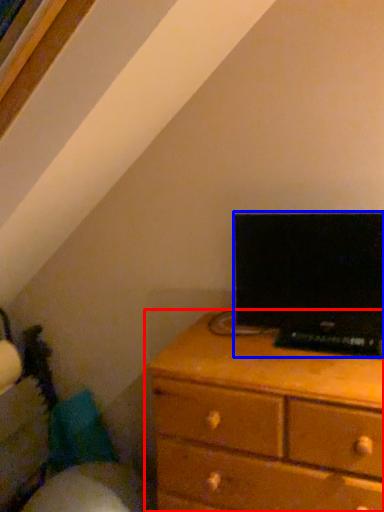
Question: Among these objects, which one is farthest to the camera, chest of drawers (highlighted by a red box) or computer (highlighted by a blue box)?

Choices:
 (A) chest of drawers
 (B) computer

Answer: (B)